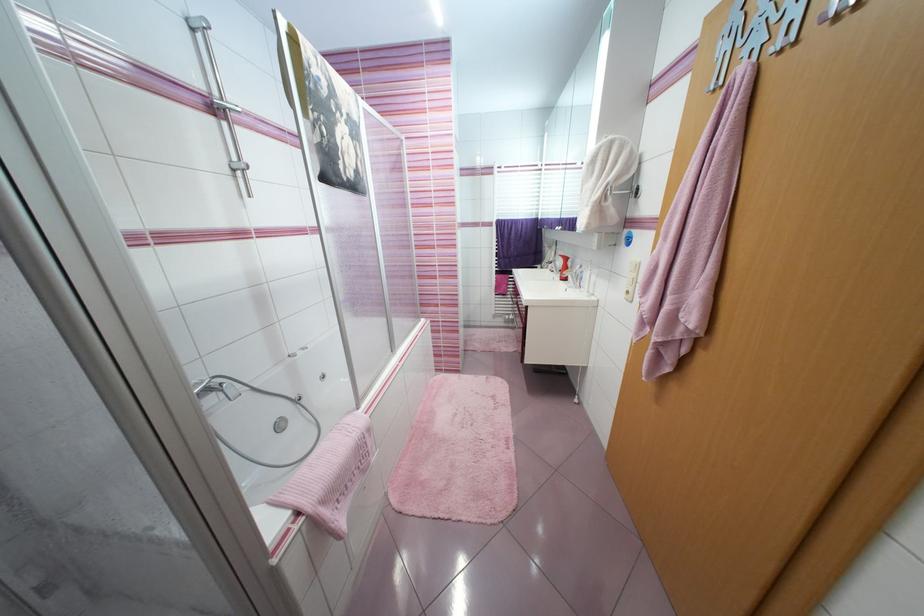
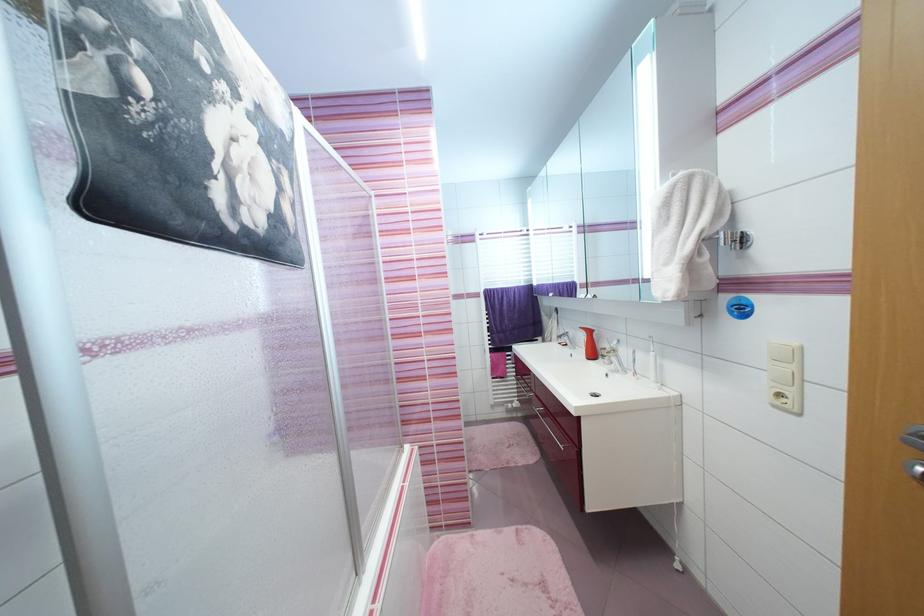
Question: The images are taken continuously from a first-person perspective. In which direction is your viewpoint rotating?

Choices:
 (A) Left
 (B) Right
 (C) Up
 (D) Down

Answer: (C)